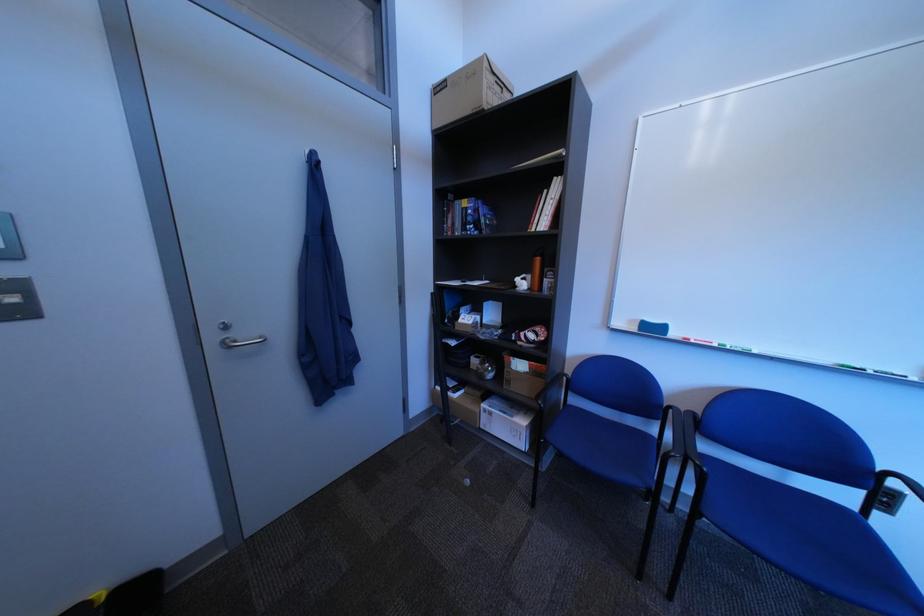
Where is `silver door handle`? The width and height of the screenshot is (924, 616). silver door handle is located at coordinates (237, 338).